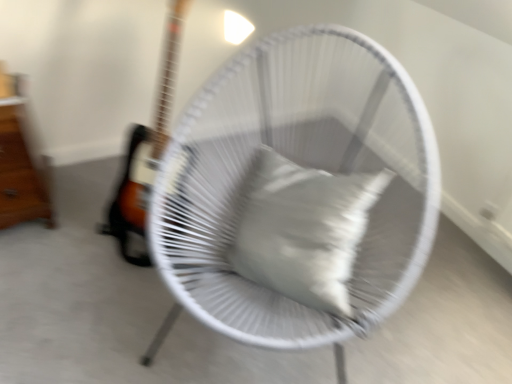
Question: Considering the positions of white woven chair at center and wooden drawer at left in the image, is white woven chair at center wider or thinner than wooden drawer at left?

Choices:
 (A) wide
 (B) thin

Answer: (A)

Question: From a real-world perspective, relative to wooden drawer at left, is white woven chair at center vertically above or below?

Choices:
 (A) above
 (B) below

Answer: (A)

Question: Based on their relative distances, which object is nearer to the wooden drawer at left?

Choices:
 (A) white woven chair at center
 (B) white matte pillow at center

Answer: (A)

Question: Based on their relative distances, which object is nearer to the wooden drawer at left?

Choices:
 (A) white woven chair at center
 (B) white matte pillow at center

Answer: (A)